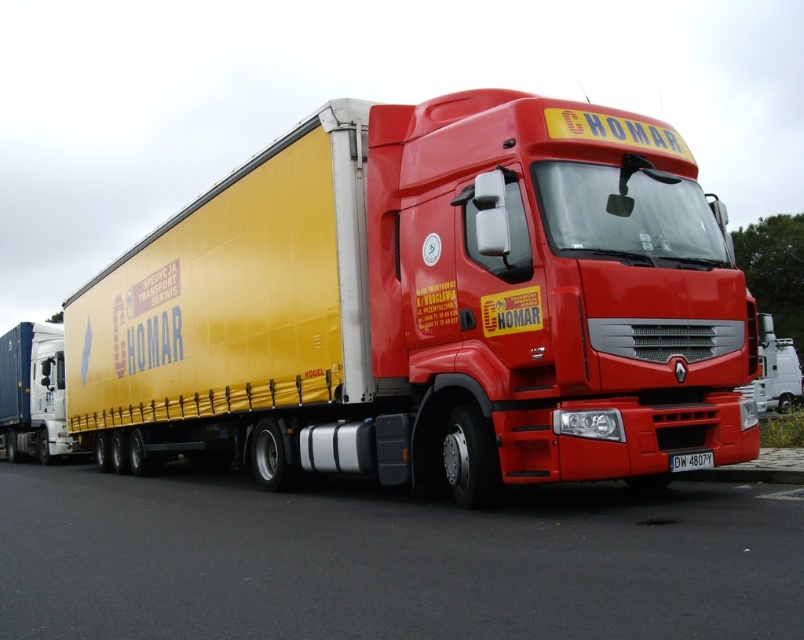
Who is shorter, metallic yellow trailer at center or metallic blue container at left?

metallic blue container at left is shorter.

Who is taller, metallic yellow trailer at center or metallic blue container at left?

metallic yellow trailer at center is taller.

Is point (544, 305) more distant than point (23, 436)?

No, (544, 305) is closer to viewer.

Where is `metallic yellow trailer at center`? The image size is (804, 640). metallic yellow trailer at center is located at coordinates 429,307.

From the picture: Between black asphalt at lower center and metallic blue container at left, which one is positioned lower?

metallic blue container at left is below.

Does black asphalt at lower center have a smaller size compared to metallic blue container at left?

Yes, black asphalt at lower center is smaller than metallic blue container at left.

Who is more distant from viewer, (679, 580) or (47, 442)?

Positioned behind is point (47, 442).

Find the location of a particular element. The height and width of the screenshot is (640, 804). black asphalt at lower center is located at coordinates (390, 561).

In the scene shown: Can you confirm if black asphalt at lower center is positioned to the left of black plastic license plate at lower center?

Yes, black asphalt at lower center is to the left of black plastic license plate at lower center.

Which is more to the right, black asphalt at lower center or black plastic license plate at lower center?

From the viewer's perspective, black plastic license plate at lower center appears more on the right side.

This screenshot has width=804, height=640. Find the location of `black asphalt at lower center`. black asphalt at lower center is located at coordinates (390, 561).

Locate an element on the screen. The height and width of the screenshot is (640, 804). black asphalt at lower center is located at coordinates (390, 561).